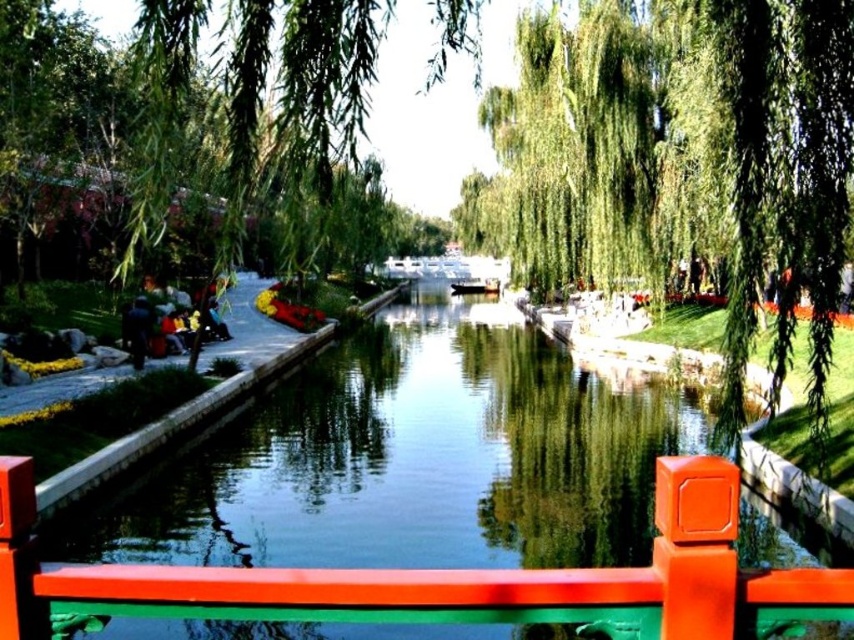
Based on the scene, which object, the green leafy willow at center or the green smooth water at center, takes up more space in the image?

The green leafy willow at center is bigger than the green smooth water at center, so it takes up more space in the image.

You are standing on the stone pathway on the left side of the canal and want to cross to the other side. The green leafy willow at upper center is blocking your view. Can you see the green smooth water at center from your current position?

The green leafy willow at upper center is blocking your view, so you cannot see the green smooth water at center from your current position on the stone pathway on the left side of the canal.